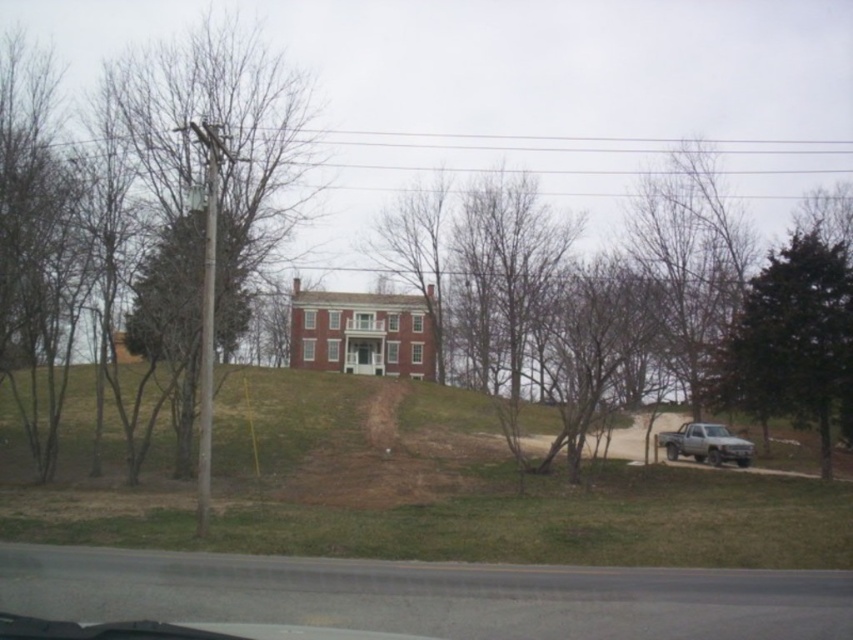
In the scene shown: You are driving along the road in the image and see a point marked at coordinates (654,305). What does this point represent?

The point at (654,305) represents the location of the bare branches at center.

Looking at this image, you are driving along the road and see the green leafy tree at right and the silver metallic truck at lower right. Which object appears taller in the scene?

The green leafy tree at right appears much taller than the silver metallic truck at lower right.